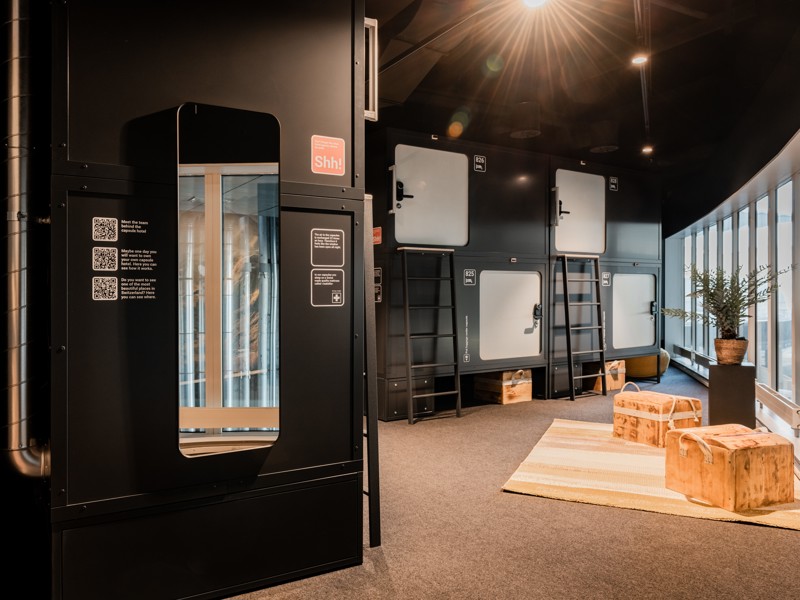
The image size is (800, 600). I want to click on window, so click(694, 254), click(710, 251), click(726, 246), click(744, 243), click(758, 237), click(782, 232).